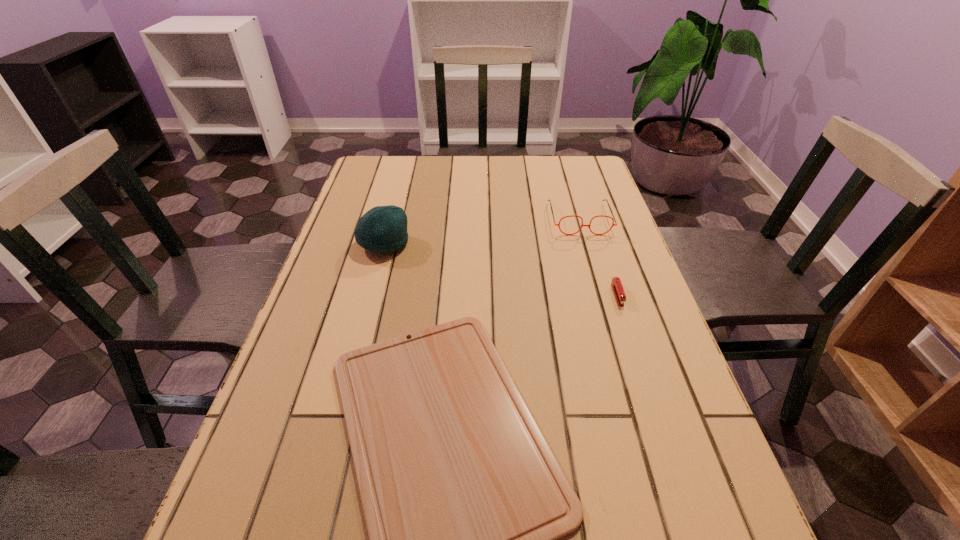
At what (x,y) coordinates should I click in order to perform the action: click on the tallest object. Please return your answer as a coordinate pair (x, y). This screenshot has width=960, height=540. Looking at the image, I should click on (383, 229).

At what (x,y) coordinates should I click in order to perform the action: click on spectacles. Please return your answer as a coordinate pair (x, y). This screenshot has width=960, height=540. Looking at the image, I should click on 613,224.

The height and width of the screenshot is (540, 960). I want to click on stapler, so click(616, 283).

You are a GUI agent. You are given a task and a screenshot of the screen. Output one action in this format:
    pyautogui.click(x=<x>, y=<y>)
    Task: Click on the second nearest object
    This screenshot has height=540, width=960.
    Given the screenshot: What is the action you would take?
    pyautogui.click(x=616, y=283)

At what (x,y) coordinates should I click in order to perform the action: click on vacant region located 0.310m on the back of the tallest object. Please return your answer as a coordinate pair (x, y). This screenshot has height=540, width=960. Looking at the image, I should click on (402, 174).

Find the location of `free spot located 0.070m on the front-facing side of the third shortest object`. free spot located 0.070m on the front-facing side of the third shortest object is located at coordinates (588, 251).

Image resolution: width=960 pixels, height=540 pixels. Identify the location of vacant space positioned on the front-facing side of the second shortest object. (636, 351).

Find the location of a particular element. object at the left edge is located at coordinates (383, 229).

The width and height of the screenshot is (960, 540). Find the location of `spectacles at the right edge`. spectacles at the right edge is located at coordinates (613, 224).

This screenshot has height=540, width=960. What are the coordinates of `stapler that is at the right edge` in the screenshot? It's located at (616, 283).